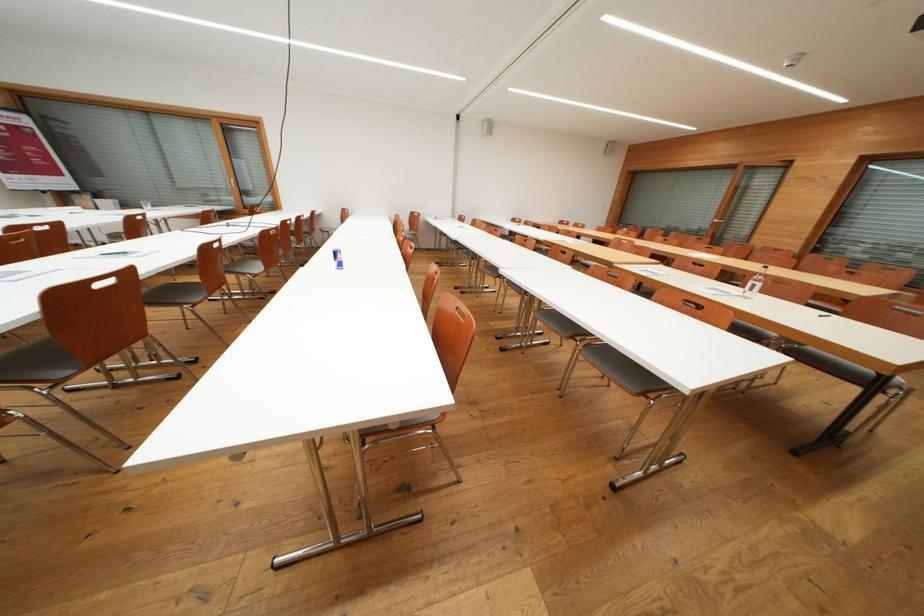
Locate an element on the screen. This screenshot has width=924, height=616. blue drink can is located at coordinates (337, 257).